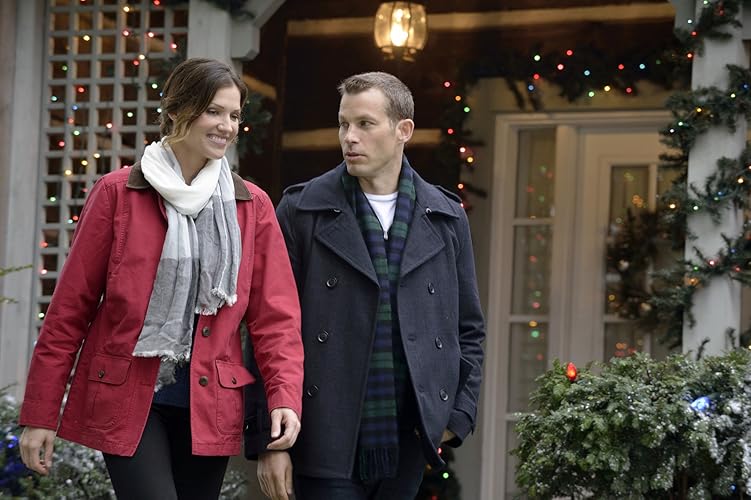
Identify the location of door. This screenshot has height=500, width=751. (601, 250).